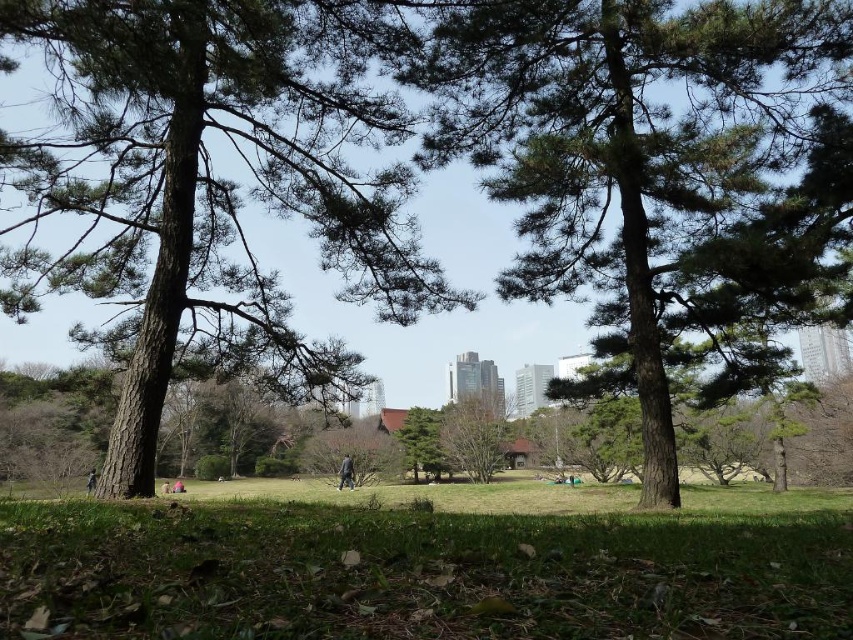
Based on the photo, you are standing in the park and see the green textured tree at center and the dark gray fabric jacket at center. If you face the direction where the buildings are located, which object is on your left?

The dark gray fabric jacket at center is on your left because the green textured tree at center is to the right of it.

You are standing in the park and see the smooth brown tree trunk at center and the dark gray fabric jacket at center. Which object is closer to you?

The smooth brown tree trunk at center is closer to you because it is in front of the dark gray fabric jacket at center.

You are a photographer aiming to capture a photo of the green textured tree at center and the dark gray fabric jacket at center. Based on their positions, which object is closer to the camera?

The green textured tree at center is below the dark gray fabric jacket at center, so the jacket is closer to the camera.